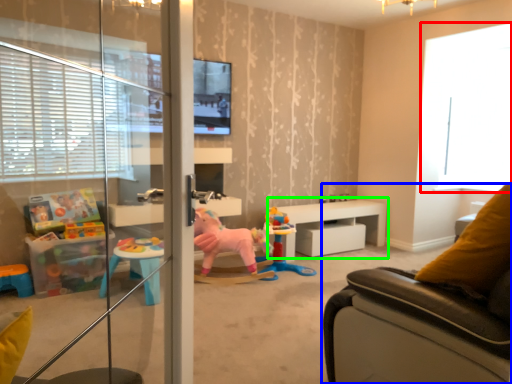
Question: Which object is the farthest from window (highlighted by a red box)? Choose among these: studio couch (highlighted by a blue box) or table (highlighted by a green box).

Choices:
 (A) studio couch
 (B) table

Answer: (A)